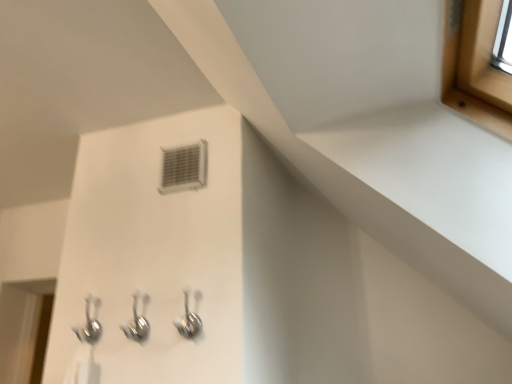
What do you see at coordinates (183, 168) in the screenshot? I see `white plastic air conditioning at center` at bounding box center [183, 168].

What is the approximate height of polished chrome hooks at lower center, which ranks as the second plumbing fixture in right-to-left order?

5.89 inches.

I want to click on polished chrome hooks at lower left, arranged as the third plumbing fixture when viewed from the right, so [x=89, y=324].

This screenshot has height=384, width=512. What do you see at coordinates (89, 324) in the screenshot? I see `polished chrome hooks at lower left, which is the first plumbing fixture from left to right` at bounding box center [89, 324].

Describe the element at coordinates (188, 320) in the screenshot. I see `satin nickel hooks at center, which ranks as the third plumbing fixture in left-to-right order` at that location.

This screenshot has width=512, height=384. Find the location of `satin nickel hooks at center, which ranks as the third plumbing fixture in left-to-right order`. satin nickel hooks at center, which ranks as the third plumbing fixture in left-to-right order is located at coordinates (188, 320).

Where is `white plastic air conditioning at center`? white plastic air conditioning at center is located at coordinates (183, 168).

From a real-world perspective, is satin nickel hooks at center, which ranks as the third plumbing fixture in left-to-right order, below white plastic air conditioning at center?

Indeed, from a real-world perspective, satin nickel hooks at center, which ranks as the third plumbing fixture in left-to-right order, is positioned beneath white plastic air conditioning at center.

Does satin nickel hooks at center, which ranks as the third plumbing fixture in left-to-right order, come behind white plastic air conditioning at center?

No, it is not.

Is satin nickel hooks at center, positioned as the 1th plumbing fixture in right-to-left order, smaller than white plastic air conditioning at center?

Incorrect, satin nickel hooks at center, positioned as the 1th plumbing fixture in right-to-left order, is not smaller in size than white plastic air conditioning at center.

Is satin nickel hooks at center, positioned as the 1th plumbing fixture in right-to-left order, shorter than white plastic air conditioning at center?

Correct, satin nickel hooks at center, positioned as the 1th plumbing fixture in right-to-left order, is not as tall as white plastic air conditioning at center.

Is polished chrome hooks at lower center, the 2th plumbing fixture viewed from the left, a part of polished chrome hooks at lower left, arranged as the third plumbing fixture when viewed from the right?

No.

From the image's perspective, which is below, polished chrome hooks at lower left, arranged as the third plumbing fixture when viewed from the right, or polished chrome hooks at lower center, the 2th plumbing fixture viewed from the left?

polished chrome hooks at lower left, arranged as the third plumbing fixture when viewed from the right, from the image's perspective.

You are a GUI agent. You are given a task and a screenshot of the screen. Output one action in this format:
    pyautogui.click(x=<x>, y=<y>)
    Task: Click on the plumbing fixture behind the polished chrome hooks at lower center, the 2th plumbing fixture viewed from the left
    Image resolution: width=512 pixels, height=384 pixels.
    Given the screenshot: What is the action you would take?
    pyautogui.click(x=89, y=324)

Does polished chrome hooks at lower left, which is the first plumbing fixture from left to right, have a lesser height compared to polished chrome hooks at lower center, the 2th plumbing fixture viewed from the left?

Incorrect, the height of polished chrome hooks at lower left, which is the first plumbing fixture from left to right, does not fall short of that of polished chrome hooks at lower center, the 2th plumbing fixture viewed from the left.

From a real-world perspective, is satin nickel hooks at center, which ranks as the third plumbing fixture in left-to-right order, physically located above or below polished chrome hooks at lower left, which is the first plumbing fixture from left to right?

In terms of real-world spatial position, satin nickel hooks at center, which ranks as the third plumbing fixture in left-to-right order, is below polished chrome hooks at lower left, which is the first plumbing fixture from left to right.

Is point (177, 326) closer or farther from the camera than point (86, 302)?

Point (177, 326) appears to be closer to the viewer than point (86, 302).

Is satin nickel hooks at center, which ranks as the third plumbing fixture in left-to-right order, located outside polished chrome hooks at lower left, which is the first plumbing fixture from left to right?

Yes, satin nickel hooks at center, which ranks as the third plumbing fixture in left-to-right order, is located beyond the bounds of polished chrome hooks at lower left, which is the first plumbing fixture from left to right.

Considering the sizes of objects satin nickel hooks at center, which ranks as the third plumbing fixture in left-to-right order, and polished chrome hooks at lower left, arranged as the third plumbing fixture when viewed from the right, in the image provided, who is shorter, satin nickel hooks at center, which ranks as the third plumbing fixture in left-to-right order, or polished chrome hooks at lower left, arranged as the third plumbing fixture when viewed from the right,?

polished chrome hooks at lower left, arranged as the third plumbing fixture when viewed from the right, is shorter.

Is polished chrome hooks at lower center, which ranks as the second plumbing fixture in right-to-left order, to the right of white plastic air conditioning at center from the viewer's perspective?

No.

Between polished chrome hooks at lower center, the 2th plumbing fixture viewed from the left, and white plastic air conditioning at center, which one is positioned in front?

polished chrome hooks at lower center, the 2th plumbing fixture viewed from the left, is more forward.

Can you tell me how much polished chrome hooks at lower center, the 2th plumbing fixture viewed from the left, and white plastic air conditioning at center differ in facing direction?

The facing directions of polished chrome hooks at lower center, the 2th plumbing fixture viewed from the left, and white plastic air conditioning at center are 0.0298 degrees apart.

Where is `the 1st plumbing fixture counting from the left of the white plastic air conditioning at center`? This screenshot has width=512, height=384. the 1st plumbing fixture counting from the left of the white plastic air conditioning at center is located at coordinates (136, 324).

Considering the sizes of white plastic air conditioning at center and polished chrome hooks at lower left, arranged as the third plumbing fixture when viewed from the right, in the image, is white plastic air conditioning at center bigger or smaller than polished chrome hooks at lower left, arranged as the third plumbing fixture when viewed from the right,?

In the image, white plastic air conditioning at center appears to be smaller than polished chrome hooks at lower left, arranged as the third plumbing fixture when viewed from the right.

Is white plastic air conditioning at center to the right of polished chrome hooks at lower left, which is the first plumbing fixture from left to right, from the viewer's perspective?

Yes, white plastic air conditioning at center is to the right of polished chrome hooks at lower left, which is the first plumbing fixture from left to right.

Is white plastic air conditioning at center spatially inside polished chrome hooks at lower left, arranged as the third plumbing fixture when viewed from the right, or outside of it?

The correct answer is: outside.

Can you confirm if white plastic air conditioning at center is thinner than polished chrome hooks at lower left, which is the first plumbing fixture from left to right?

Indeed, white plastic air conditioning at center has a lesser width compared to polished chrome hooks at lower left, which is the first plumbing fixture from left to right.

From a real-world perspective, who is located higher, polished chrome hooks at lower center, the 2th plumbing fixture viewed from the left, or polished chrome hooks at lower left, arranged as the third plumbing fixture when viewed from the right?

From a 3D spatial view, polished chrome hooks at lower left, arranged as the third plumbing fixture when viewed from the right, is above.

Considering the sizes of polished chrome hooks at lower center, the 2th plumbing fixture viewed from the left, and polished chrome hooks at lower left, which is the first plumbing fixture from left to right, in the image, is polished chrome hooks at lower center, the 2th plumbing fixture viewed from the left, taller or shorter than polished chrome hooks at lower left, which is the first plumbing fixture from left to right,?

Considering their sizes, polished chrome hooks at lower center, the 2th plumbing fixture viewed from the left, has less height than polished chrome hooks at lower left, which is the first plumbing fixture from left to right.

Which of these two, polished chrome hooks at lower center, which ranks as the second plumbing fixture in right-to-left order, or polished chrome hooks at lower left, which is the first plumbing fixture from left to right, is wider?

polished chrome hooks at lower left, which is the first plumbing fixture from left to right.

Could you tell me if polished chrome hooks at lower center, which ranks as the second plumbing fixture in right-to-left order, is facing polished chrome hooks at lower left, arranged as the third plumbing fixture when viewed from the right?

No, polished chrome hooks at lower center, which ranks as the second plumbing fixture in right-to-left order, is not turned towards polished chrome hooks at lower left, arranged as the third plumbing fixture when viewed from the right.

From a real-world perspective, between white plastic air conditioning at center and satin nickel hooks at center, positioned as the 1th plumbing fixture in right-to-left order, who is vertically lower?

satin nickel hooks at center, positioned as the 1th plumbing fixture in right-to-left order.

Can you confirm if white plastic air conditioning at center is taller than satin nickel hooks at center, positioned as the 1th plumbing fixture in right-to-left order?

Correct, white plastic air conditioning at center is much taller as satin nickel hooks at center, positioned as the 1th plumbing fixture in right-to-left order.

Can you tell me how much white plastic air conditioning at center and satin nickel hooks at center, positioned as the 1th plumbing fixture in right-to-left order, differ in facing direction?

The facing directions of white plastic air conditioning at center and satin nickel hooks at center, positioned as the 1th plumbing fixture in right-to-left order, are 0.0298 degrees apart.

In the scene shown: Can you confirm if white plastic air conditioning at center is positioned to the left of satin nickel hooks at center, positioned as the 1th plumbing fixture in right-to-left order?

Correct, you'll find white plastic air conditioning at center to the left of satin nickel hooks at center, positioned as the 1th plumbing fixture in right-to-left order.

You are a GUI agent. You are given a task and a screenshot of the screen. Output one action in this format:
    pyautogui.click(x=<x>, y=<y>)
    Task: Click on the 3rd plumbing fixture in front of the white plastic air conditioning at center, starting your count from the anchor
    This screenshot has width=512, height=384.
    Given the screenshot: What is the action you would take?
    pyautogui.click(x=188, y=320)

The height and width of the screenshot is (384, 512). Find the location of `plumbing fixture lying behind the polished chrome hooks at lower center, the 2th plumbing fixture viewed from the left`. plumbing fixture lying behind the polished chrome hooks at lower center, the 2th plumbing fixture viewed from the left is located at coordinates (89, 324).

Looking at the image, which one is located further to satin nickel hooks at center, positioned as the 1th plumbing fixture in right-to-left order, white plastic air conditioning at center or polished chrome hooks at lower center, the 2th plumbing fixture viewed from the left?

white plastic air conditioning at center.

Looking at the image, which one is located closer to polished chrome hooks at lower left, which is the first plumbing fixture from left to right, polished chrome hooks at lower center, which ranks as the second plumbing fixture in right-to-left order, or white plastic air conditioning at center?

polished chrome hooks at lower center, which ranks as the second plumbing fixture in right-to-left order.

From the image, which object appears to be farther from polished chrome hooks at lower left, which is the first plumbing fixture from left to right, satin nickel hooks at center, which ranks as the third plumbing fixture in left-to-right order, or polished chrome hooks at lower center, which ranks as the second plumbing fixture in right-to-left order?

Based on the image, satin nickel hooks at center, which ranks as the third plumbing fixture in left-to-right order, appears to be further to polished chrome hooks at lower left, which is the first plumbing fixture from left to right.

Estimate the real-world distances between objects in this image. Which object is further from polished chrome hooks at lower left, which is the first plumbing fixture from left to right, white plastic air conditioning at center or satin nickel hooks at center, positioned as the 1th plumbing fixture in right-to-left order?

Based on the image, white plastic air conditioning at center appears to be further to polished chrome hooks at lower left, which is the first plumbing fixture from left to right.

From the image, which object appears to be nearer to white plastic air conditioning at center, satin nickel hooks at center, which ranks as the third plumbing fixture in left-to-right order, or polished chrome hooks at lower center, which ranks as the second plumbing fixture in right-to-left order?

Among the two, satin nickel hooks at center, which ranks as the third plumbing fixture in left-to-right order, is located nearer to white plastic air conditioning at center.

When comparing their distances from white plastic air conditioning at center, does satin nickel hooks at center, positioned as the 1th plumbing fixture in right-to-left order, or polished chrome hooks at lower left, arranged as the third plumbing fixture when viewed from the right, seem further?

polished chrome hooks at lower left, arranged as the third plumbing fixture when viewed from the right, is positioned further to the anchor white plastic air conditioning at center.

Consider the image. Looking at the image, which one is located closer to satin nickel hooks at center, positioned as the 1th plumbing fixture in right-to-left order, polished chrome hooks at lower left, arranged as the third plumbing fixture when viewed from the right, or polished chrome hooks at lower center, which ranks as the second plumbing fixture in right-to-left order?

polished chrome hooks at lower center, which ranks as the second plumbing fixture in right-to-left order, lies closer to satin nickel hooks at center, positioned as the 1th plumbing fixture in right-to-left order, than the other object.

When comparing their distances from white plastic air conditioning at center, does polished chrome hooks at lower center, the 2th plumbing fixture viewed from the left, or satin nickel hooks at center, which ranks as the third plumbing fixture in left-to-right order, seem further?

The object further to white plastic air conditioning at center is polished chrome hooks at lower center, the 2th plumbing fixture viewed from the left.

The width and height of the screenshot is (512, 384). What are the coordinates of `plumbing fixture that lies between white plastic air conditioning at center and polished chrome hooks at lower center, which ranks as the second plumbing fixture in right-to-left order, from top to bottom` in the screenshot? It's located at tap(188, 320).

Identify the location of plumbing fixture between polished chrome hooks at lower left, which is the first plumbing fixture from left to right, and satin nickel hooks at center, which ranks as the third plumbing fixture in left-to-right order. (136, 324).